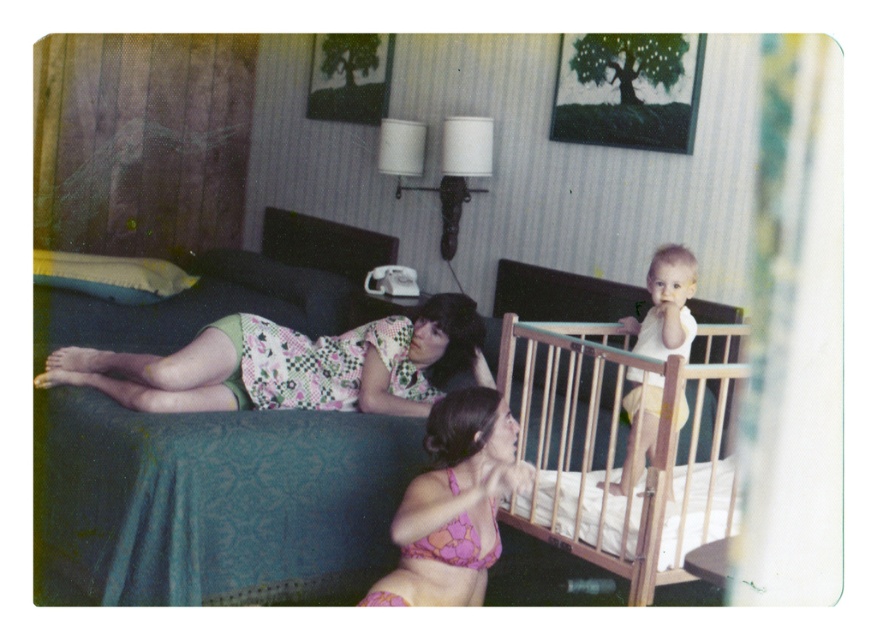
Does wooden crib at lower center have a lesser height compared to floral fabric dress at upper left?

No.

The height and width of the screenshot is (640, 877). What do you see at coordinates (614, 424) in the screenshot?
I see `wooden crib at lower center` at bounding box center [614, 424].

Is point (581, 532) positioned behind point (467, 364)?

That is False.

Find the location of a particular element. This screenshot has width=877, height=640. wooden crib at lower center is located at coordinates (614, 424).

Does wooden crib at center appear under pink floral bikini top at lower center?

No.

This screenshot has width=877, height=640. Describe the element at coordinates (211, 502) in the screenshot. I see `wooden crib at center` at that location.

You are a GUI agent. You are given a task and a screenshot of the screen. Output one action in this format:
    pyautogui.click(x=<x>, y=<y>)
    Task: Click on the wooden crib at center
    Image resolution: width=877 pixels, height=640 pixels.
    Given the screenshot: What is the action you would take?
    pyautogui.click(x=211, y=502)

Is floral fabric dress at upper left shorter than pink floral bikini top at lower center?

Correct, floral fabric dress at upper left is not as tall as pink floral bikini top at lower center.

Is floral fabric dress at upper left taller than pink floral bikini top at lower center?

No, floral fabric dress at upper left is not taller than pink floral bikini top at lower center.

Find the location of a particular element. floral fabric dress at upper left is located at coordinates (290, 365).

Image resolution: width=877 pixels, height=640 pixels. I want to click on floral fabric dress at upper left, so click(290, 365).